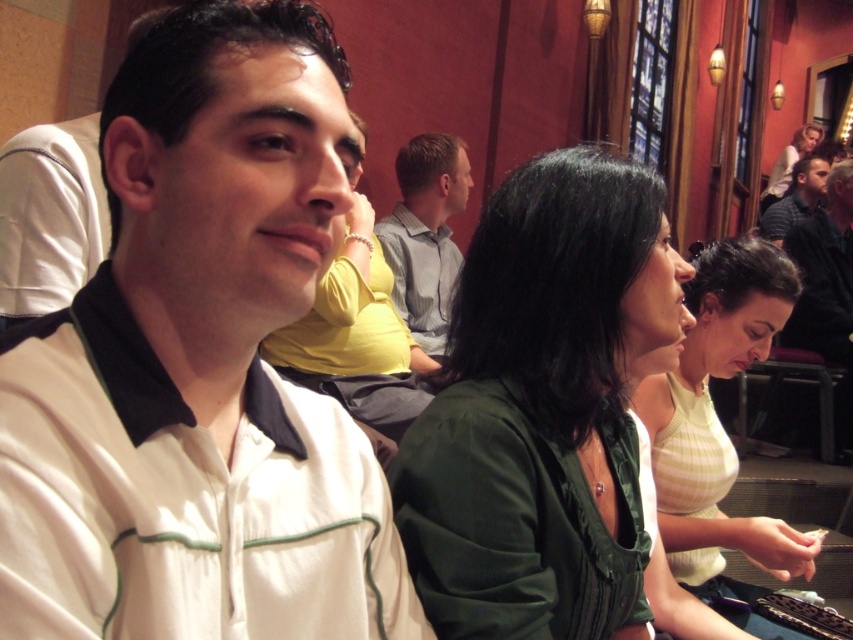
Question: Is light green knit sweater at center thinner than matte green blouse at center?

Choices:
 (A) yes
 (B) no

Answer: (A)

Question: Does matte green blouse at center appear under dark blue shirt at right?

Choices:
 (A) no
 (B) yes

Answer: (B)

Question: Which point appears closest to the camera in this image?

Choices:
 (A) (820, 330)
 (B) (370, 387)
 (C) (114, 413)
 (D) (444, 180)

Answer: (C)

Question: Can you confirm if matte green blouse at center is wider than dark blue shirt at upper right?

Choices:
 (A) no
 (B) yes

Answer: (A)

Question: Which point is farther from the camera taking this photo?

Choices:
 (A) (733, 470)
 (B) (809, 141)
 (C) (173, 288)

Answer: (B)

Question: Among these objects, which one is farthest from the camera?

Choices:
 (A) light green knit sweater at center
 (B) matte green blouse at center
 (C) dark blue shirt at right
 (D) green fabric shirt at center

Answer: (C)